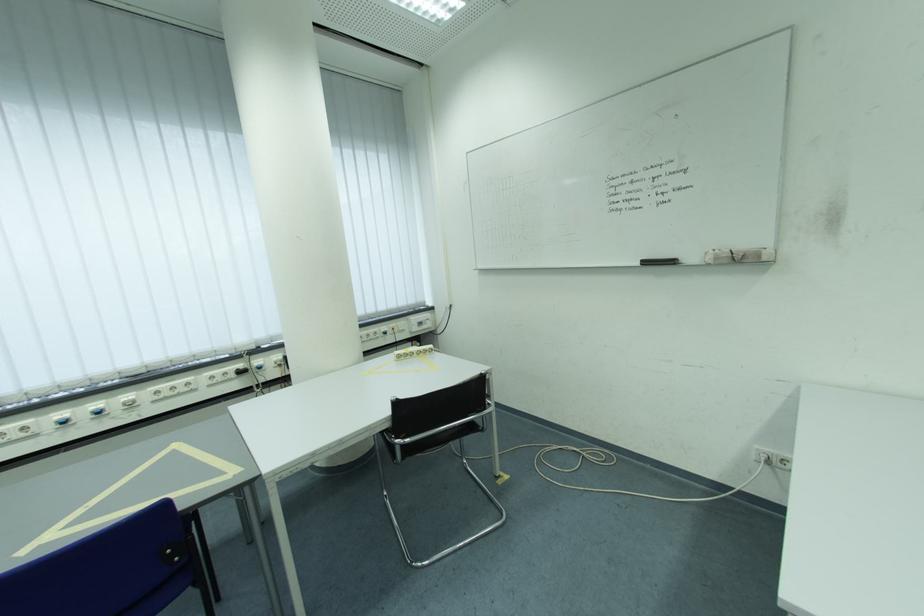
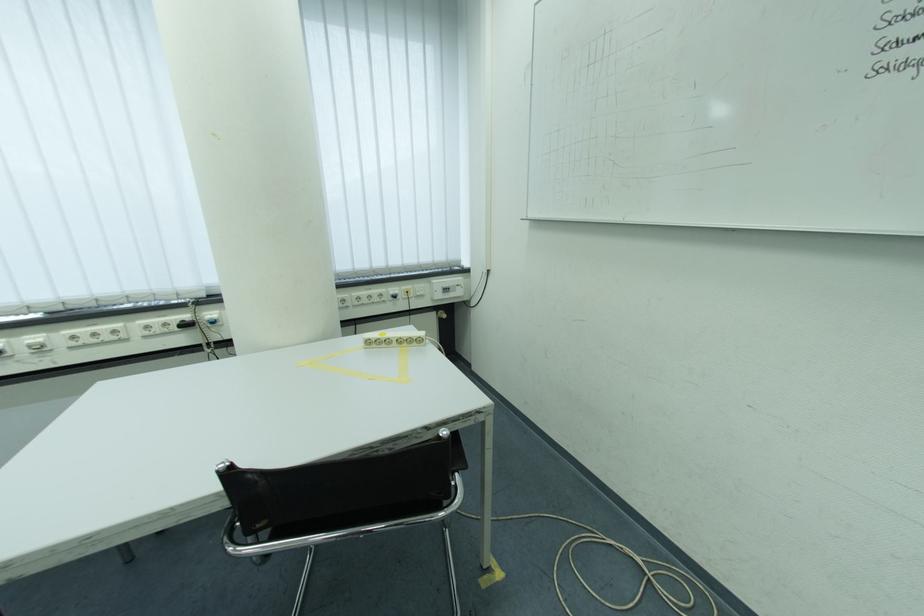
Locate, in the second image, the point that corresponds to point 165,395 in the first image.

(82, 339)